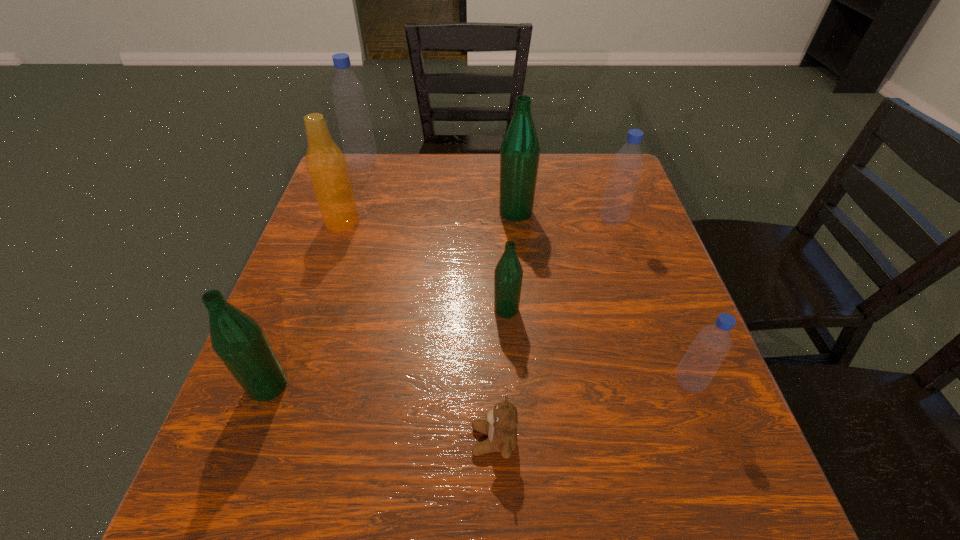
Find the location of a particular element. This screenshot has width=960, height=540. the farthest blue bottle is located at coordinates (358, 142).

What are the coordinates of `the farthest bottle` in the screenshot? It's located at (358, 142).

Identify the location of the farthest green bottle. The width and height of the screenshot is (960, 540). (520, 151).

Identify the location of beer bottle. Image resolution: width=960 pixels, height=540 pixels. (326, 165).

I want to click on the second farthest blue bottle, so click(627, 165).

At what (x,y) coordinates should I click in order to perform the action: click on the nearest green bottle. Please return your answer as a coordinate pair (x, y). Looking at the image, I should click on (239, 341).

Identify the location of the leftmost green bottle. Image resolution: width=960 pixels, height=540 pixels. (239, 341).

Locate an element on the screen. the fifth farthest object is located at coordinates (508, 274).

Where is `the fourth farthest bottle`? The width and height of the screenshot is (960, 540). the fourth farthest bottle is located at coordinates (508, 274).

The image size is (960, 540). In order to click on the nearest blue bottle in this screenshot , I will do `click(698, 366)`.